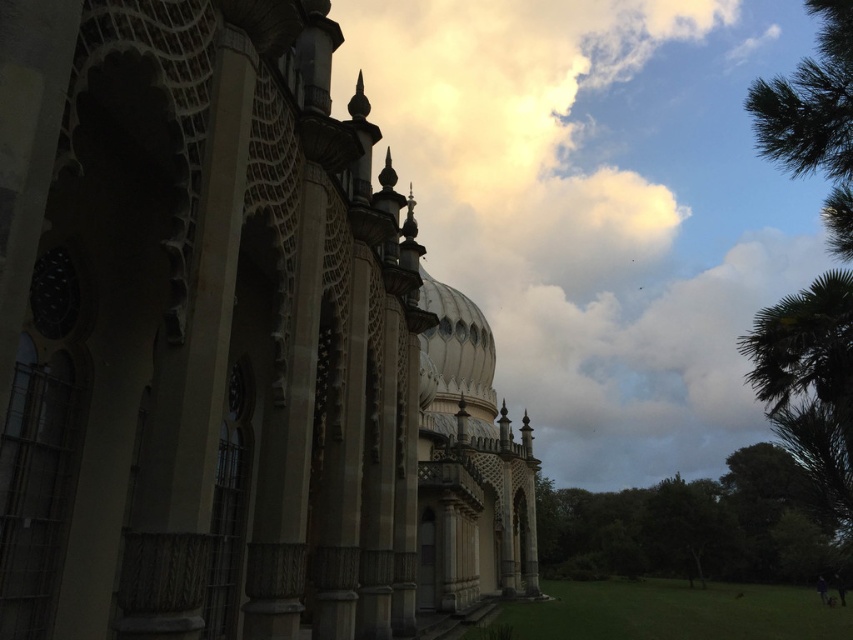
Question: Which object is the closest to the stone mosaic palace at center?

Choices:
 (A) green leafy palm tree at upper right
 (B) white textured dome at center
 (C) green leafy tree at lower right

Answer: (B)

Question: Which point appears farthest from the camera in this image?

Choices:
 (A) (834, 81)
 (B) (483, 378)

Answer: (B)

Question: Does green leafy palm tree at upper right have a greater width compared to white textured dome at center?

Choices:
 (A) yes
 (B) no

Answer: (A)

Question: Is stone mosaic palace at center to the left of white textured dome at center from the viewer's perspective?

Choices:
 (A) yes
 (B) no

Answer: (B)

Question: Is stone mosaic palace at center to the right of green leafy palm tree at upper right from the viewer's perspective?

Choices:
 (A) yes
 (B) no

Answer: (B)

Question: Which point is farther to the camera?

Choices:
 (A) (577, 556)
 (B) (427, 349)

Answer: (A)